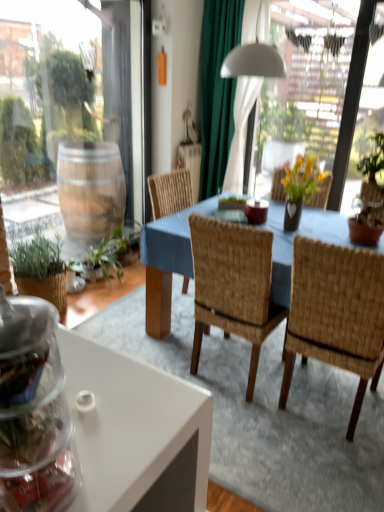
The width and height of the screenshot is (384, 512). I want to click on woven wood chair at center, which is the second chair from left to right, so click(x=336, y=314).

Image resolution: width=384 pixels, height=512 pixels. In order to click on green fabric curtain at upper center in this screenshot , I will do click(217, 90).

You are a GUI agent. You are given a task and a screenshot of the screen. Output one action in this format:
    pyautogui.click(x=<x>, y=<y>)
    Task: Click on the transparent plastic jar at lower left
    This screenshot has width=384, height=512.
    Given the screenshot: What is the action you would take?
    pyautogui.click(x=34, y=411)

You are a GUI agent. You are given a task and a screenshot of the screen. Output one action in this format:
    pyautogui.click(x=<x>, y=<y>)
    Task: Click on the woven wood chair at center, which is the second chair from left to right
    
    Given the screenshot: What is the action you would take?
    pyautogui.click(x=336, y=314)

From the image's perspective, is green fabric curtain at upper center above or below transparent plastic jar at lower left?

green fabric curtain at upper center is above transparent plastic jar at lower left.

From a real-world perspective, which is physically below, green fabric curtain at upper center or transparent plastic jar at lower left?

From a 3D spatial view, transparent plastic jar at lower left is below.

Is green fabric curtain at upper center to the left of transparent plastic jar at lower left from the viewer's perspective?

No.

Is woven wood chair at center, which is the 1th chair from left to right, spatially inside green fabric curtain at upper center, or outside of it?

woven wood chair at center, which is the 1th chair from left to right, lies outside green fabric curtain at upper center.

Does woven wood chair at center, which is the 1th chair from left to right, turn towards green fabric curtain at upper center?

No, woven wood chair at center, which is the 1th chair from left to right, is not aimed at green fabric curtain at upper center.

Which object is thinner, woven wood chair at center, which is the 1th chair from left to right, or green fabric curtain at upper center?

green fabric curtain at upper center.

Considering the positions of objects woven wood chair at center, which is the 1th chair from left to right, and woven wood chair at center, the 1th chair positioned from the right, in the image provided, who is more to the right, woven wood chair at center, which is the 1th chair from left to right, or woven wood chair at center, the 1th chair positioned from the right,?

Positioned to the right is woven wood chair at center, the 1th chair positioned from the right.

Locate an element on the screen. The image size is (384, 512). chair lying in front of the woven wood chair at center, which is the 1th chair from left to right is located at coordinates (336, 314).

Would you say woven wood chair at center, which is counted as the 2th chair, starting from the right, is outside woven wood chair at center, which is the second chair from left to right?

Absolutely, woven wood chair at center, which is counted as the 2th chair, starting from the right, is external to woven wood chair at center, which is the second chair from left to right.

Is woven wood chair at center, which is the 1th chair from left to right, wider than woven wood chair at center, the 1th chair positioned from the right?

No, woven wood chair at center, which is the 1th chair from left to right, is not wider than woven wood chair at center, the 1th chair positioned from the right.

Is green fabric curtain at upper center completely or partially outside of woven wood chair at center, which is the 1th chair from left to right?

Absolutely, green fabric curtain at upper center is external to woven wood chair at center, which is the 1th chair from left to right.

Considering the relative sizes of green fabric curtain at upper center and woven wood chair at center, which is the 1th chair from left to right, in the image provided, is green fabric curtain at upper center bigger than woven wood chair at center, which is the 1th chair from left to right,?

Yes.

Identify the location of curtain located behind the woven wood chair at center, which is counted as the 2th chair, starting from the right. Image resolution: width=384 pixels, height=512 pixels. (217, 90).

Considering the positions of point (232, 100) and point (196, 289), is point (232, 100) closer or farther from the camera than point (196, 289)?

Point (232, 100).

Is woven wood chair at center, the 1th chair positioned from the right, at the right side of green fabric curtain at upper center?

Yes, woven wood chair at center, the 1th chair positioned from the right, is to the right of green fabric curtain at upper center.

Is the surface of woven wood chair at center, the 1th chair positioned from the right, in direct contact with green fabric curtain at upper center?

No, woven wood chair at center, the 1th chair positioned from the right, is not touching green fabric curtain at upper center.

Based on the photo, considering the sizes of objects woven wood chair at center, the 1th chair positioned from the right, and green fabric curtain at upper center in the image provided, who is wider, woven wood chair at center, the 1th chair positioned from the right, or green fabric curtain at upper center?

woven wood chair at center, the 1th chair positioned from the right.

From a real-world perspective, does woven wood chair at center, the 1th chair positioned from the right, sit lower than green fabric curtain at upper center?

Yes, from a real-world perspective, woven wood chair at center, the 1th chair positioned from the right, is beneath green fabric curtain at upper center.

Between transparent plastic jar at lower left and woven wood chair at center, which is the second chair from left to right, which one has smaller size?

transparent plastic jar at lower left.

Is point (0, 443) positioned in front of point (342, 285)?

That is True.

Between transparent plastic jar at lower left and woven wood chair at center, the 1th chair positioned from the right, which one is positioned in front?

transparent plastic jar at lower left is in front.

Is transparent plastic jar at lower left far from woven wood chair at center, the 1th chair positioned from the right?

Yes, transparent plastic jar at lower left and woven wood chair at center, the 1th chair positioned from the right, are located far from each other.

In the scene shown: Considering the sizes of objects transparent plastic jar at lower left and woven wood chair at center, which is the 1th chair from left to right, in the image provided, who is shorter, transparent plastic jar at lower left or woven wood chair at center, which is the 1th chair from left to right,?

Standing shorter between the two is transparent plastic jar at lower left.

From the image's perspective, which object appears higher, transparent plastic jar at lower left or woven wood chair at center, which is the 1th chair from left to right?

woven wood chair at center, which is the 1th chair from left to right, is shown above in the image.

Considering the relative positions of transparent plastic jar at lower left and woven wood chair at center, which is the 1th chair from left to right, in the image provided, is transparent plastic jar at lower left behind woven wood chair at center, which is the 1th chair from left to right,?

No, it is in front of woven wood chair at center, which is the 1th chair from left to right.

From a real-world perspective, which object stands above the other?

In real-world perspective, transparent plastic jar at lower left is above.

Identify the location of glass jar below the green fabric curtain at upper center (from a real-world perspective). This screenshot has height=512, width=384. (34, 411).

The height and width of the screenshot is (512, 384). Identify the location of curtain above the woven wood chair at center, which is counted as the 2th chair, starting from the right (from a real-world perspective). (217, 90).

Which object lies nearer to the anchor point woven wood chair at center, which is the second chair from left to right, green fabric curtain at upper center or woven wood chair at center, which is counted as the 2th chair, starting from the right?

The object closer to woven wood chair at center, which is the second chair from left to right, is woven wood chair at center, which is counted as the 2th chair, starting from the right.

In the scene shown: From the image, which object appears to be nearer to woven wood chair at center, which is the 1th chair from left to right, woven wood chair at center, the 1th chair positioned from the right, or green fabric curtain at upper center?

woven wood chair at center, the 1th chair positioned from the right, is closer to woven wood chair at center, which is the 1th chair from left to right.

When comparing their distances from transparent plastic jar at lower left, does woven wood chair at center, which is the second chair from left to right, or green fabric curtain at upper center seem closer?

The object closer to transparent plastic jar at lower left is woven wood chair at center, which is the second chair from left to right.

Which object lies nearer to the anchor point green fabric curtain at upper center, woven wood chair at center, which is counted as the 2th chair, starting from the right, or woven wood chair at center, the 1th chair positioned from the right?

woven wood chair at center, which is counted as the 2th chair, starting from the right, lies closer to green fabric curtain at upper center than the other object.

From the image, which object appears to be nearer to woven wood chair at center, which is the 1th chair from left to right, transparent plastic jar at lower left or woven wood chair at center, which is the second chair from left to right?

woven wood chair at center, which is the second chair from left to right, is closer to woven wood chair at center, which is the 1th chair from left to right.

When comparing their distances from woven wood chair at center, the 1th chair positioned from the right, does green fabric curtain at upper center or transparent plastic jar at lower left seem further?

green fabric curtain at upper center is further to woven wood chair at center, the 1th chair positioned from the right.

Based on the photo, looking at the image, which one is located further to woven wood chair at center, which is counted as the 2th chair, starting from the right, transparent plastic jar at lower left or green fabric curtain at upper center?

green fabric curtain at upper center.

Consider the image. Based on their spatial positions, is woven wood chair at center, which is the second chair from left to right, or transparent plastic jar at lower left further from green fabric curtain at upper center?

transparent plastic jar at lower left is further to green fabric curtain at upper center.

This screenshot has height=512, width=384. I want to click on chair that lies between green fabric curtain at upper center and woven wood chair at center, which is the second chair from left to right, from top to bottom, so click(x=232, y=286).

Locate an element on the screen. This screenshot has width=384, height=512. chair positioned between transparent plastic jar at lower left and woven wood chair at center, which is counted as the 2th chair, starting from the right, from near to far is located at coordinates (336, 314).